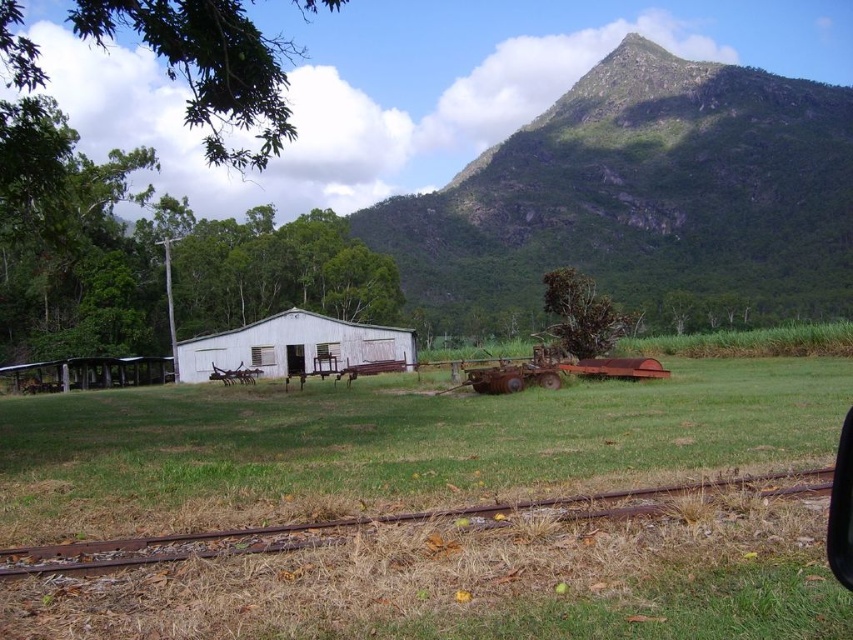
Consider the image. Is white matte barn at center positioned before transparent glass car window at lower right?

No, white matte barn at center is further to the viewer.

Is white matte barn at center below transparent glass car window at lower right?

Incorrect, white matte barn at center is not positioned below transparent glass car window at lower right.

What do you see at coordinates (294, 346) in the screenshot? I see `white matte barn at center` at bounding box center [294, 346].

The width and height of the screenshot is (853, 640). What are the coordinates of `white matte barn at center` in the screenshot? It's located at (294, 346).

Is point (730, 257) positioned after point (288, 326)?

Yes, point (730, 257) is farther from viewer.

Between green rocky mountain at upper center and white matte barn at center, which one is positioned higher?

green rocky mountain at upper center is higher up.

Describe the element at coordinates (642, 195) in the screenshot. The height and width of the screenshot is (640, 853). I see `green rocky mountain at upper center` at that location.

Locate an element on the screen. This screenshot has height=640, width=853. green rocky mountain at upper center is located at coordinates (642, 195).

Is point (804, 470) positioned behind point (329, 356)?

No, (804, 470) is closer to viewer.

Between rusty metal train track at lower center and white matte barn at center, which one appears on the left side from the viewer's perspective?

white matte barn at center is more to the left.

Identify the location of rusty metal train track at lower center. (370, 524).

Image resolution: width=853 pixels, height=640 pixels. In order to click on rusty metal train track at lower center in this screenshot , I will do [370, 524].